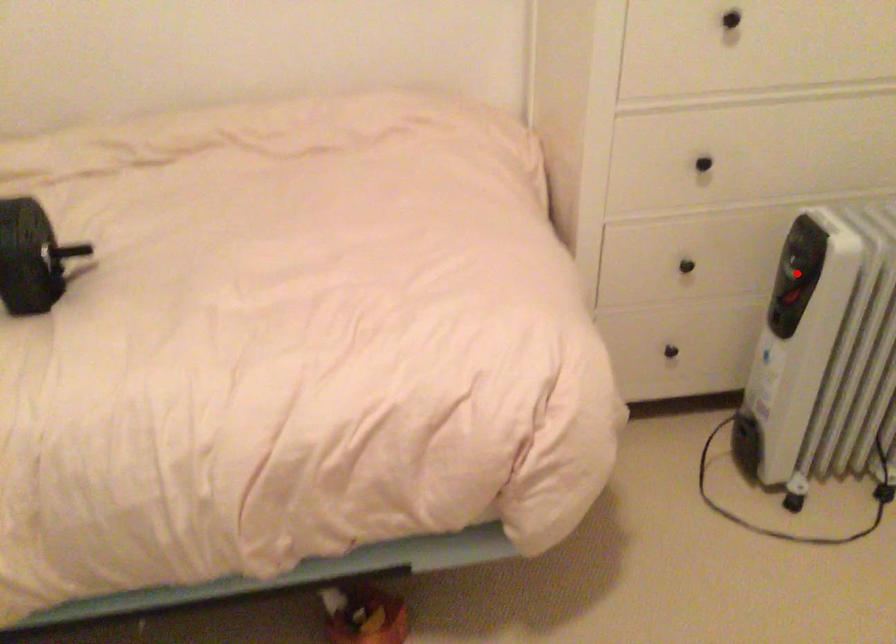
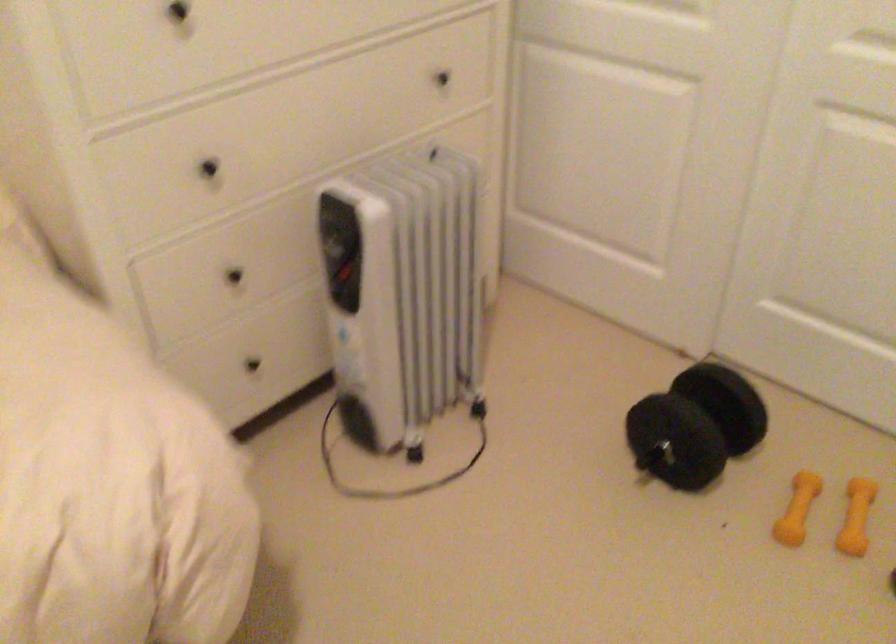
Where in the second image is the point corresponding to the highlighted location from the first image?

(340, 250)